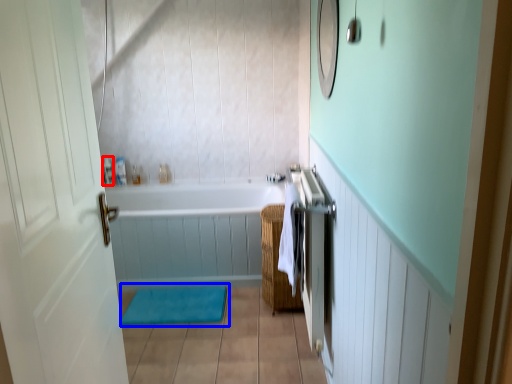
Question: Which object appears closest to the camera in this image, toiletry (highlighted by a red box) or bath mat (highlighted by a blue box)?

Choices:
 (A) toiletry
 (B) bath mat

Answer: (B)